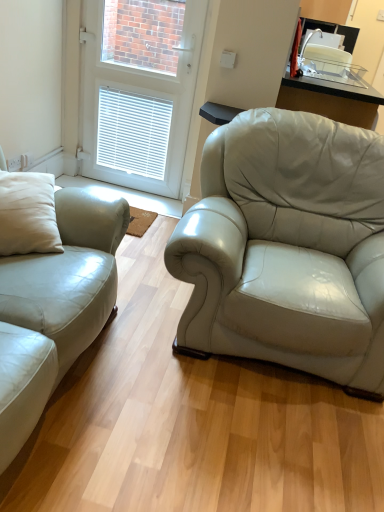
Identify the location of unoccupied region to the right of satin white leather couch at left. (196, 410).